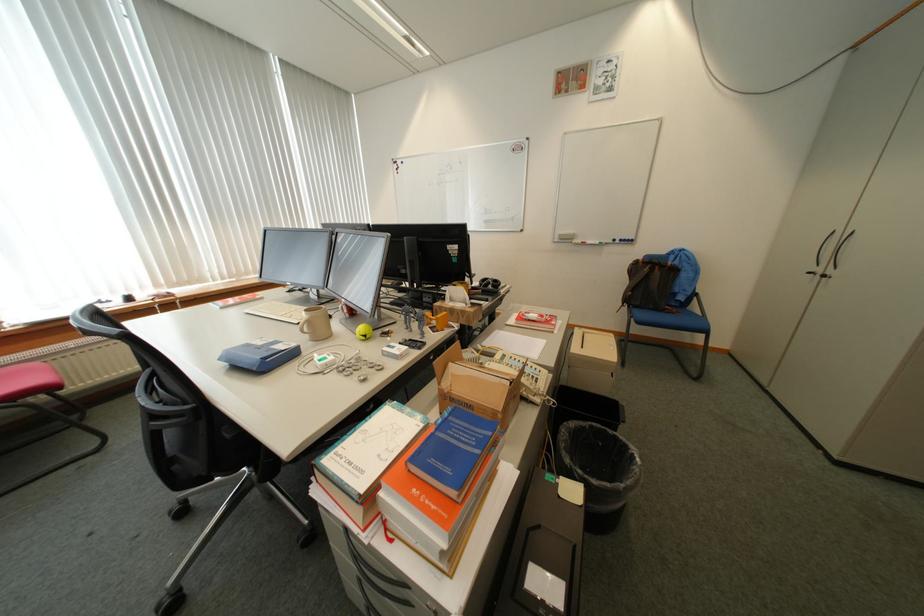
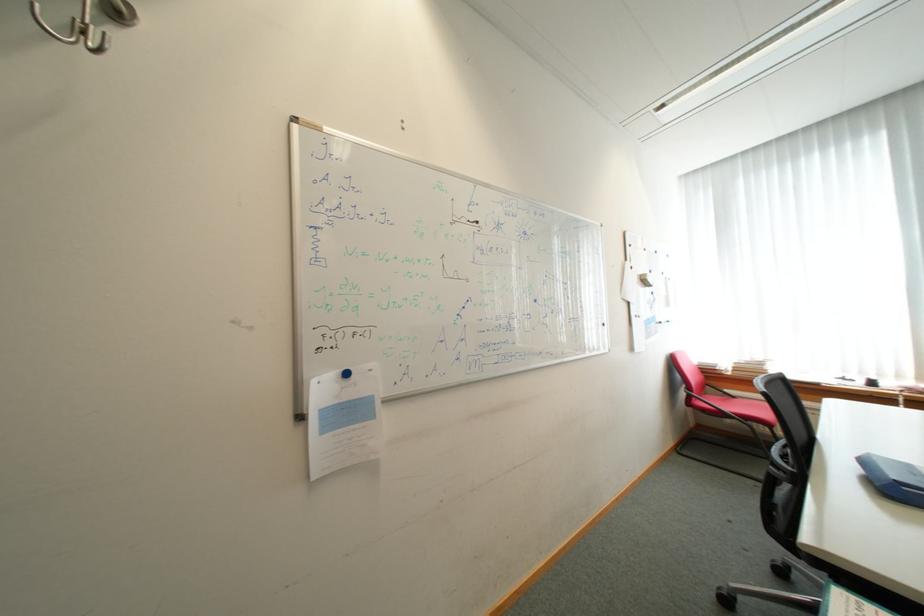
In the second image, find the point that corresponds to (198,408) in the first image.

(800, 469)